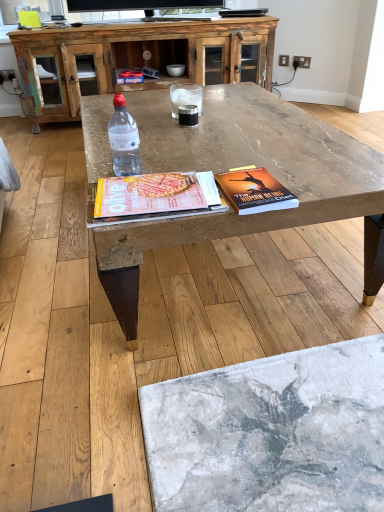
Question: Can you confirm if hardcover book at center is shorter than clear glass at center?

Choices:
 (A) no
 (B) yes

Answer: (B)

Question: Is hardcover book at center not inside clear glass at center?

Choices:
 (A) no
 (B) yes

Answer: (B)

Question: Does hardcover book at center contain clear glass at center?

Choices:
 (A) no
 (B) yes

Answer: (A)

Question: Does hardcover book at center have a greater height compared to clear glass at center?

Choices:
 (A) yes
 (B) no

Answer: (B)

Question: From the image's perspective, is hardcover book at center located beneath clear glass at center?

Choices:
 (A) no
 (B) yes

Answer: (B)

Question: Does hardcover book at center have a greater width compared to clear glass at center?

Choices:
 (A) no
 (B) yes

Answer: (B)

Question: Is the surface of rustic wood cabinet at upper center in direct contact with marble textured coffee table at center?

Choices:
 (A) no
 (B) yes

Answer: (A)

Question: From the image's perspective, would you say rustic wood cabinet at upper center is positioned over marble textured coffee table at center?

Choices:
 (A) yes
 (B) no

Answer: (A)

Question: Is rustic wood cabinet at upper center far away from marble textured coffee table at center?

Choices:
 (A) yes
 (B) no

Answer: (A)

Question: Can you confirm if rustic wood cabinet at upper center is wider than marble textured coffee table at center?

Choices:
 (A) no
 (B) yes

Answer: (A)

Question: Does rustic wood cabinet at upper center have a lesser height compared to marble textured coffee table at center?

Choices:
 (A) no
 (B) yes

Answer: (A)

Question: Can you confirm if rustic wood cabinet at upper center is taller than marble textured coffee table at center?

Choices:
 (A) no
 (B) yes

Answer: (B)

Question: Is marble textured coffee table at center bigger than clear glass at center?

Choices:
 (A) no
 (B) yes

Answer: (B)